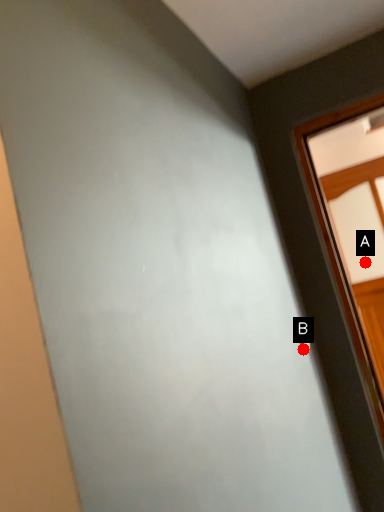
Question: Two points are circled on the image, labeled by A and B beside each circle. Among these points, which one is farthest from the camera?

Choices:
 (A) A is further
 (B) B is further

Answer: (A)